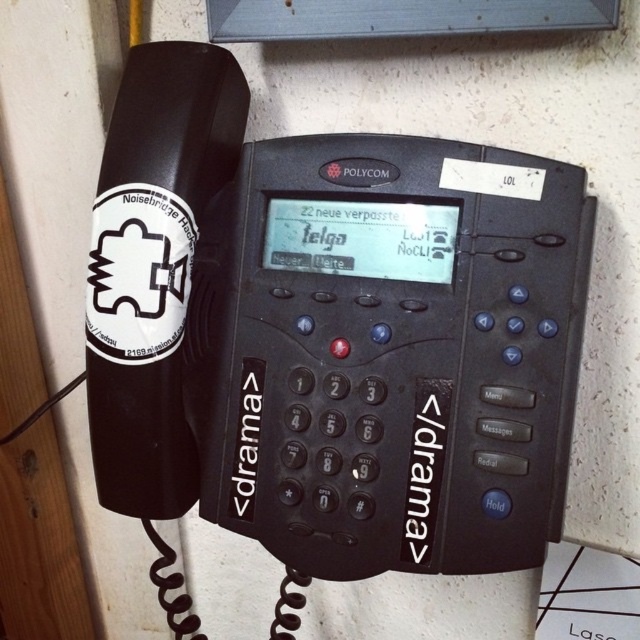
Question: Does black plastic phone at center have a larger size compared to white sticker at left?

Choices:
 (A) no
 (B) yes

Answer: (B)

Question: Which point is closer to the camera?

Choices:
 (A) (132, 301)
 (B) (104, 332)

Answer: (A)

Question: Is black plastic phone at center closer to the viewer compared to white sticker at left?

Choices:
 (A) yes
 (B) no

Answer: (A)

Question: Is black plastic phone at center below white sticker at left?

Choices:
 (A) yes
 (B) no

Answer: (A)

Question: Which object is closer to the camera taking this photo?

Choices:
 (A) white sticker at left
 (B) black plastic phone at center

Answer: (B)